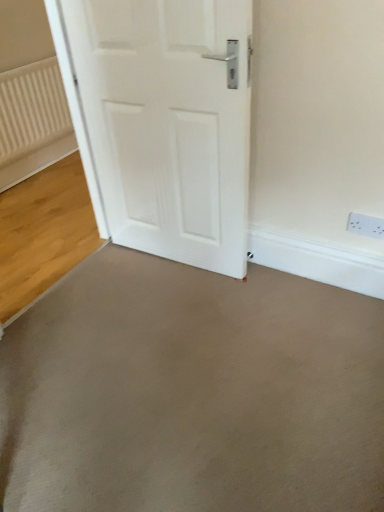
Image resolution: width=384 pixels, height=512 pixels. What do you see at coordinates (192, 393) in the screenshot? I see `smooth concrete floor at center, arranged as the second concrete when viewed from the back` at bounding box center [192, 393].

Locate an element on the screen. Image resolution: width=384 pixels, height=512 pixels. white plastic electric outlet at upper right is located at coordinates (366, 225).

Based on the photo, measure the distance between white plastic electric outlet at upper right and camera.

The distance of white plastic electric outlet at upper right from camera is 5.39 feet.

This screenshot has width=384, height=512. Describe the element at coordinates (169, 122) in the screenshot. I see `white matte door at center` at that location.

Find the location of a particular element. smooth concrete floor at center, the 1th concrete positioned from the front is located at coordinates (192, 393).

Which is more to the right, smooth concrete floor at center, arranged as the second concrete when viewed from the back, or gray smooth concrete at center, which appears as the first concrete when viewed from the back?

From the viewer's perspective, smooth concrete floor at center, arranged as the second concrete when viewed from the back, appears more on the right side.

Between point (63, 443) and point (29, 294), which one is positioned behind?

The point (29, 294) is farther.

Is smooth concrete floor at center, arranged as the second concrete when viewed from the back, next to gray smooth concrete at center, which appears as the first concrete when viewed from the back?

There is a gap between smooth concrete floor at center, arranged as the second concrete when viewed from the back, and gray smooth concrete at center, which appears as the first concrete when viewed from the back.

Is smooth concrete floor at center, arranged as the second concrete when viewed from the back, located within white textured radiator at left?

That's incorrect, smooth concrete floor at center, arranged as the second concrete when viewed from the back, is not inside white textured radiator at left.

From the image's perspective, is white textured radiator at left below smooth concrete floor at center, the 1th concrete positioned from the front?

No.

Considering the relative positions of white textured radiator at left and smooth concrete floor at center, arranged as the second concrete when viewed from the back, in the image provided, is white textured radiator at left to the left or to the right of smooth concrete floor at center, arranged as the second concrete when viewed from the back,?

Based on their positions, white textured radiator at left is located to the left of smooth concrete floor at center, arranged as the second concrete when viewed from the back.

Consider the image. From a real-world perspective, is white textured radiator at left positioned under smooth concrete floor at center, the 1th concrete positioned from the front, based on gravity?

No, from a real-world perspective, white textured radiator at left is not below smooth concrete floor at center, the 1th concrete positioned from the front.

Is white plastic electric outlet at upper right facing towards white matte door at center?

No.

Considering the sizes of objects white plastic electric outlet at upper right and white matte door at center in the image provided, who is bigger, white plastic electric outlet at upper right or white matte door at center?

white matte door at center is bigger.

Based on their positions, is white plastic electric outlet at upper right located to the left or right of white matte door at center?

white plastic electric outlet at upper right is to the right of white matte door at center.

Who is more distant, white matte door at center or gray smooth concrete at center, which appears as the first concrete when viewed from the back?

Positioned behind is gray smooth concrete at center, which appears as the first concrete when viewed from the back.

From the image's perspective, is white matte door at center located beneath gray smooth concrete at center, which appears as the first concrete when viewed from the back?

No, from the image's perspective, white matte door at center is not beneath gray smooth concrete at center, which appears as the first concrete when viewed from the back.

Can you confirm if white matte door at center is positioned to the right of gray smooth concrete at center, which appears as the first concrete when viewed from the back?

Yes.

Consider the image. How different are the orientations of white matte door at center and gray smooth concrete at center, which appears as the first concrete when viewed from the back, in degrees?

87.1 degrees.

Is gray smooth concrete at center, the 2th concrete viewed from the front, in front of or behind white plastic electric outlet at upper right in the image?

gray smooth concrete at center, the 2th concrete viewed from the front, is positioned farther from the viewer than white plastic electric outlet at upper right.

The width and height of the screenshot is (384, 512). In order to click on electric outlet below the gray smooth concrete at center, which appears as the first concrete when viewed from the back (from the image's perspective) in this screenshot , I will do `click(366, 225)`.

From a real-world perspective, is gray smooth concrete at center, which appears as the first concrete when viewed from the back, located beneath white plastic electric outlet at upper right?

Correct, in the physical world, gray smooth concrete at center, which appears as the first concrete when viewed from the back, is lower than white plastic electric outlet at upper right.

From the image's perspective, is gray smooth concrete at center, which appears as the first concrete when viewed from the back, positioned above or below white plastic electric outlet at upper right?

gray smooth concrete at center, which appears as the first concrete when viewed from the back, is situated higher than white plastic electric outlet at upper right in the image.

Does point (19, 272) come closer to viewer compared to point (167, 47)?

No, it is not.

Could you tell me if gray smooth concrete at center, the 2th concrete viewed from the front, is turned towards white matte door at center?

No.

Considering the sizes of gray smooth concrete at center, the 2th concrete viewed from the front, and white matte door at center in the image, is gray smooth concrete at center, the 2th concrete viewed from the front, wider or thinner than white matte door at center?

Clearly, gray smooth concrete at center, the 2th concrete viewed from the front, has more width compared to white matte door at center.

Between gray smooth concrete at center, which appears as the first concrete when viewed from the back, and white matte door at center, which one has less height?

With less height is gray smooth concrete at center, which appears as the first concrete when viewed from the back.

Is smooth concrete floor at center, arranged as the second concrete when viewed from the back, touching white textured radiator at left?

No.

Which object is positioned more to the right, smooth concrete floor at center, the 1th concrete positioned from the front, or white textured radiator at left?

smooth concrete floor at center, the 1th concrete positioned from the front, is more to the right.

Where is `concrete lying below the gray smooth concrete at center, the 2th concrete viewed from the front (from the image's perspective)`? This screenshot has width=384, height=512. concrete lying below the gray smooth concrete at center, the 2th concrete viewed from the front (from the image's perspective) is located at coordinates (192, 393).

Locate an element on the screen. The height and width of the screenshot is (512, 384). radiator above the smooth concrete floor at center, arranged as the second concrete when viewed from the back (from a real-world perspective) is located at coordinates (32, 109).

Consider the image. Estimate the real-world distances between objects in this image. Which object is further from gray smooth concrete at center, which appears as the first concrete when viewed from the back, white plastic electric outlet at upper right or white textured radiator at left?

white plastic electric outlet at upper right is further to gray smooth concrete at center, which appears as the first concrete when viewed from the back.

Estimate the real-world distances between objects in this image. Which object is further from white plastic electric outlet at upper right, white matte door at center or white textured radiator at left?

Based on the image, white textured radiator at left appears to be further to white plastic electric outlet at upper right.

From the image, which object appears to be farther from white textured radiator at left, white matte door at center or gray smooth concrete at center, the 2th concrete viewed from the front?

The object further to white textured radiator at left is white matte door at center.

Looking at the image, which one is located closer to white matte door at center, smooth concrete floor at center, arranged as the second concrete when viewed from the back, or gray smooth concrete at center, which appears as the first concrete when viewed from the back?

smooth concrete floor at center, arranged as the second concrete when viewed from the back.

Considering their positions, is white plastic electric outlet at upper right positioned closer to white textured radiator at left than gray smooth concrete at center, the 2th concrete viewed from the front?

gray smooth concrete at center, the 2th concrete viewed from the front, lies closer to white textured radiator at left than the other object.

Which object lies further to the anchor point white plastic electric outlet at upper right, smooth concrete floor at center, the 1th concrete positioned from the front, or white textured radiator at left?

white textured radiator at left is positioned further to the anchor white plastic electric outlet at upper right.

From the image, which object appears to be farther from white textured radiator at left, smooth concrete floor at center, the 1th concrete positioned from the front, or white plastic electric outlet at upper right?

Among the two, white plastic electric outlet at upper right is located further to white textured radiator at left.

Based on their spatial positions, is smooth concrete floor at center, the 1th concrete positioned from the front, or white plastic electric outlet at upper right further from gray smooth concrete at center, the 2th concrete viewed from the front?

white plastic electric outlet at upper right is further to gray smooth concrete at center, the 2th concrete viewed from the front.

At what (x,y) coordinates should I click in order to perform the action: click on door between white textured radiator at left and white plastic electric outlet at upper right. Please return your answer as a coordinate pair (x, y). Image resolution: width=384 pixels, height=512 pixels. Looking at the image, I should click on (169, 122).

Locate an element on the screen. door between gray smooth concrete at center, the 2th concrete viewed from the front, and white plastic electric outlet at upper right, in the horizontal direction is located at coordinates (169, 122).

This screenshot has width=384, height=512. What are the coordinates of `concrete between gray smooth concrete at center, the 2th concrete viewed from the front, and white plastic electric outlet at upper right, in the horizontal direction` in the screenshot? It's located at (192, 393).

You are a GUI agent. You are given a task and a screenshot of the screen. Output one action in this format:
    pyautogui.click(x=<x>, y=<y>)
    Task: Click on the concrete between white matte door at center and white textured radiator at left from front to back
    The width and height of the screenshot is (384, 512).
    Given the screenshot: What is the action you would take?
    pyautogui.click(x=44, y=232)